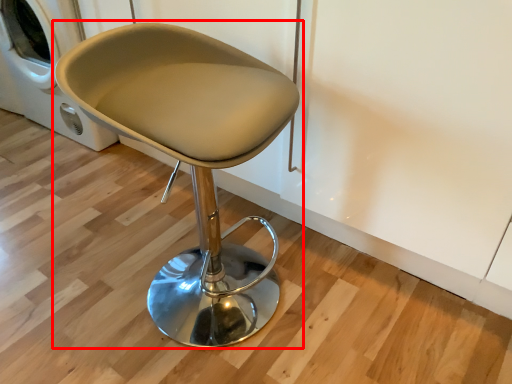
Question: From the image's perspective, where is chair (annotated by the red box) located relative to washing machine?

Choices:
 (A) below
 (B) above

Answer: (A)